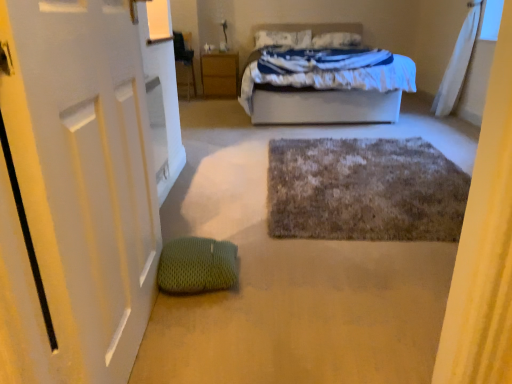
I want to click on free space to the back side of green textured bean bag at lower left, so click(x=228, y=238).